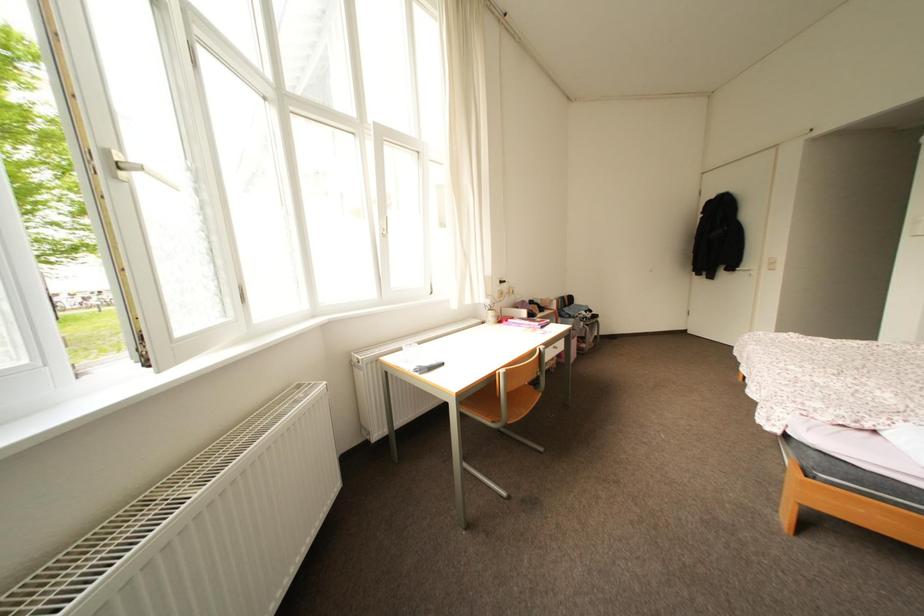
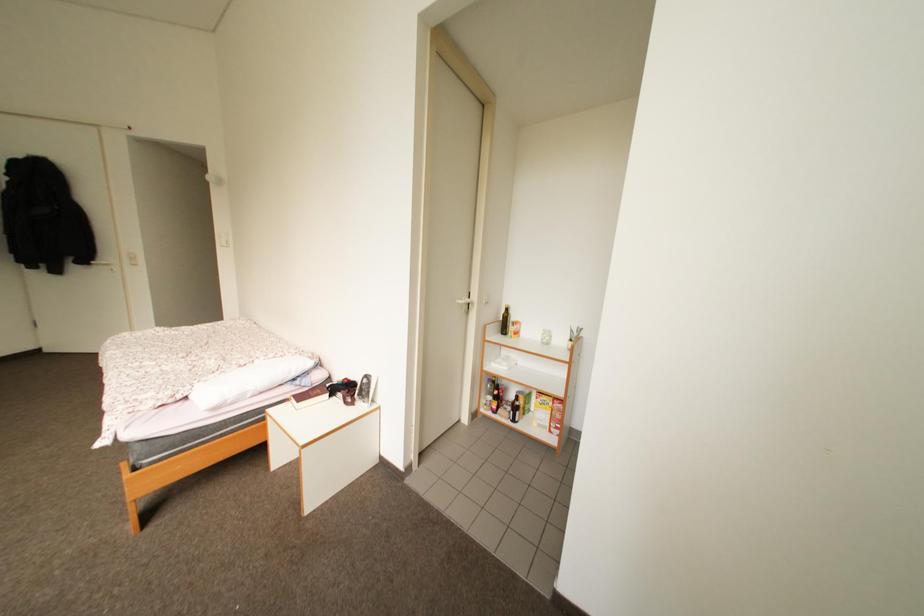
Question: The images are taken continuously from a first-person perspective. In which direction is your viewpoint rotating?

Choices:
 (A) Left
 (B) Right
 (C) Up
 (D) Down

Answer: (B)